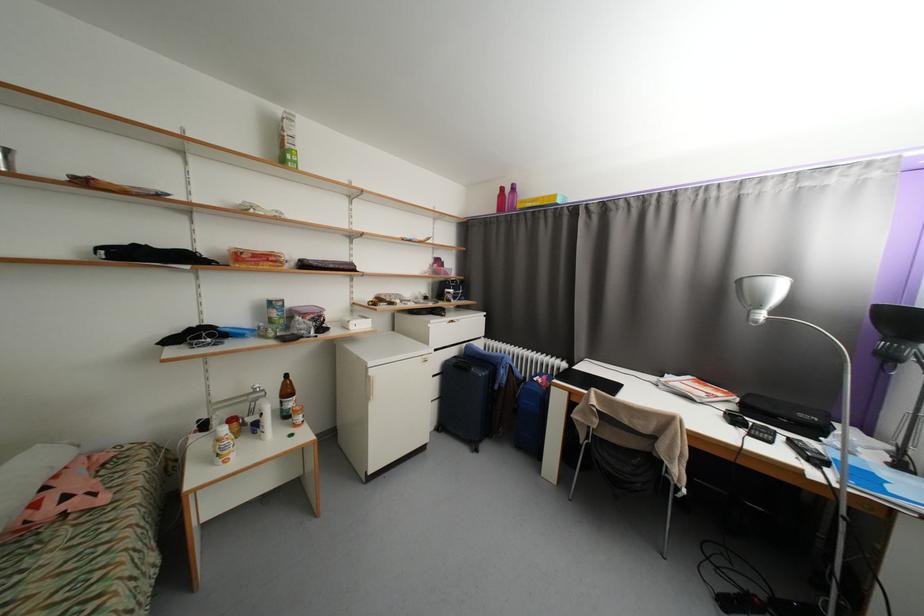
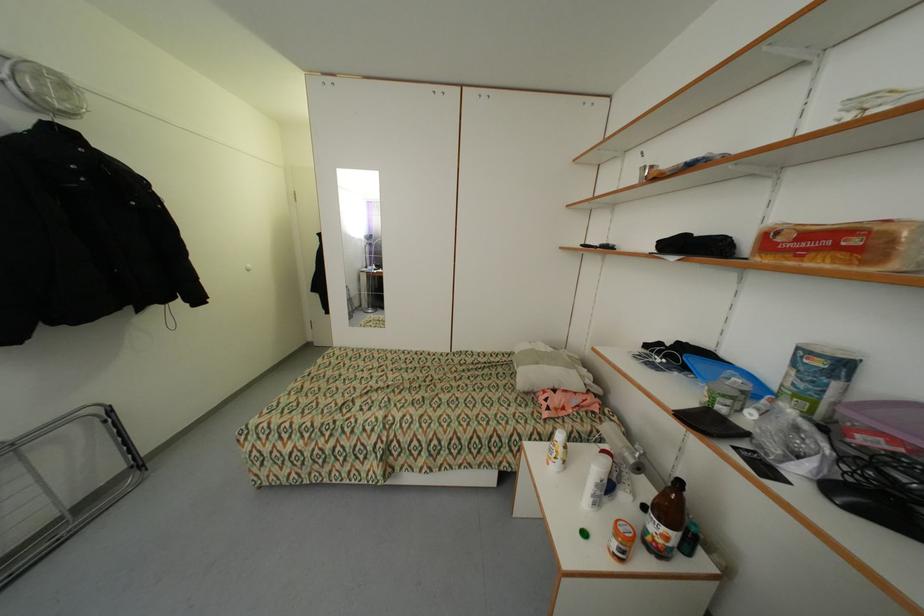
In the second image, find the point that corresponds to (280,260) in the first image.

(860, 241)